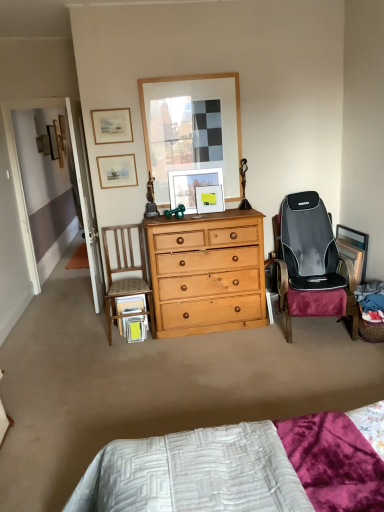
Identify the location of vacant space situated above matte wooden picture frame at center, which appears as the 5th picture frame when viewed from the top (from a real-world perspective). The image size is (384, 512). pyautogui.click(x=192, y=168).